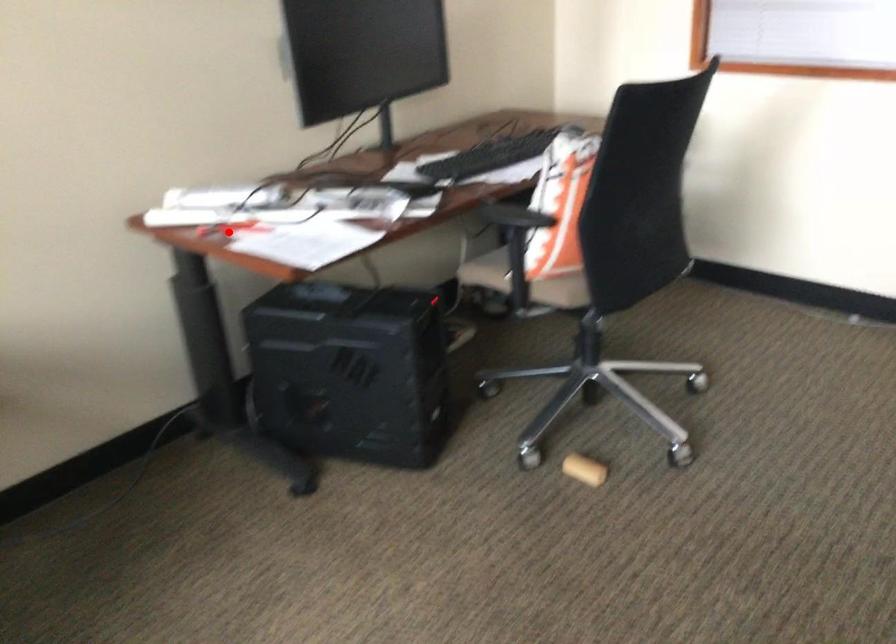
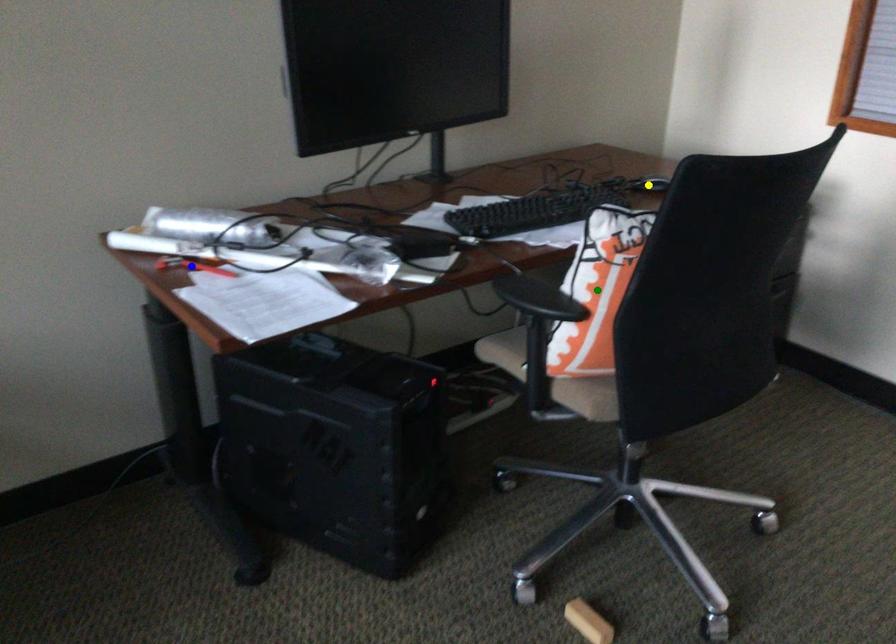
Question: I am providing you with two images of the same scene from different viewpoints. A red point is marked on the first image. You are given multiple points on the second image. Which mark in image 2 goes with the point in image 1?

Choices:
 (A) blue point
 (B) yellow point
 (C) green point

Answer: (A)